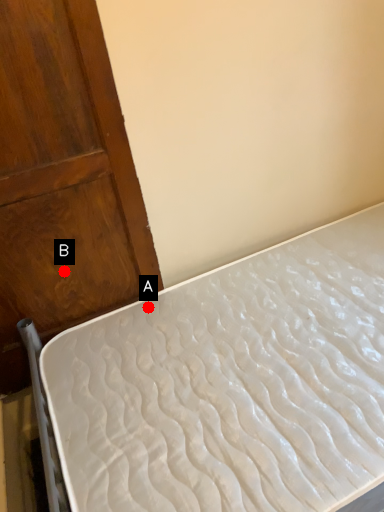
Question: Two points are circled on the image, labeled by A and B beside each circle. Which of the following is the closest to the observer?

Choices:
 (A) A is closer
 (B) B is closer

Answer: (B)